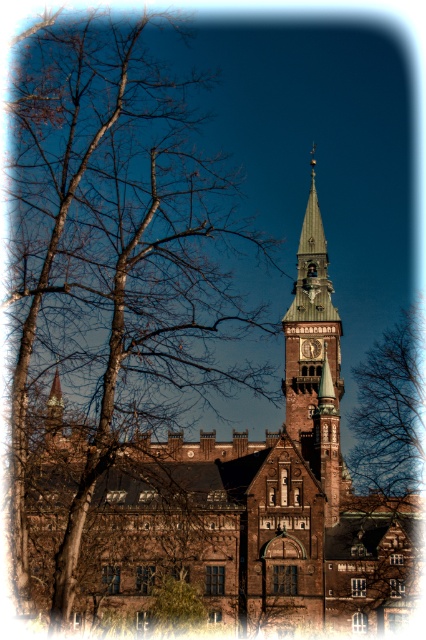
You are standing in front of the historic building and want to take a photo that includes both the brown textured tree at left and the tall pointed spire. Based on their positions, where should you position yourself to ensure both are in the frame?

The brown textured tree at left is located at point (114, 257), so you should position yourself in a spot that allows your camera to capture both the tree and the spire by considering their coordinates.

You are standing in front of the historic building and notice a brown textured tree at left and a green wooden clock tower at upper center. Which object is positioned to the left of the other?

The brown textured tree at left is to the left of the green wooden clock tower at upper center.